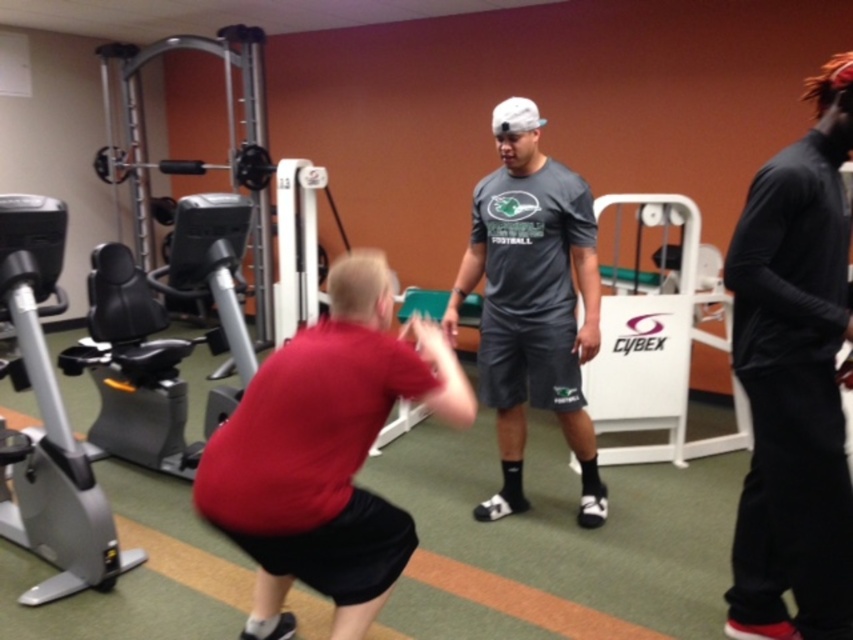
Question: Observing the image, what is the correct spatial positioning of red matte shirt at center in reference to silver metallic exercise bike at left?

Choices:
 (A) right
 (B) left

Answer: (A)

Question: Considering the real-world distances, which object is farthest from the black matte pants at right?

Choices:
 (A) red matte shirt at center
 (B) dark gray t-shirt at center
 (C) silver metallic exercise bike at left
 (D) white plastic cybex machine at center

Answer: (C)

Question: Which point appears farthest from the camera in this image?

Choices:
 (A) (744, 422)
 (B) (73, 513)
 (C) (805, 406)
 (D) (566, 275)

Answer: (A)

Question: Which object is positioned closest to the silver metallic exercise bike at left?

Choices:
 (A) dark gray t-shirt at center
 (B) red matte shirt at center
 (C) black matte pants at right

Answer: (B)

Question: Where is silver metallic exercise bike at left located in relation to white plastic cybex machine at center in the image?

Choices:
 (A) below
 (B) above

Answer: (A)

Question: Can you confirm if red matte shirt at center is thinner than silver metallic exercise bike at left?

Choices:
 (A) yes
 (B) no

Answer: (B)